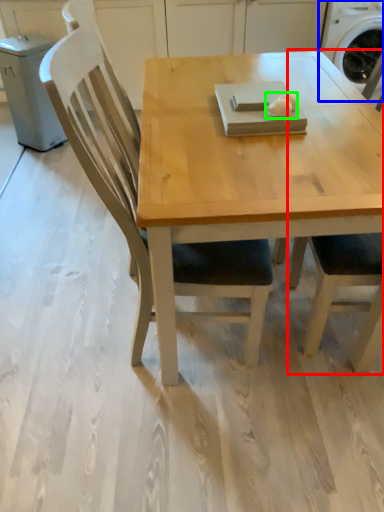
Question: Estimate the real-world distances between objects in this image. Which object is farther from chair (highlighted by a red box), washing machine (highlighted by a blue box) or food (highlighted by a green box)?

Choices:
 (A) washing machine
 (B) food

Answer: (A)